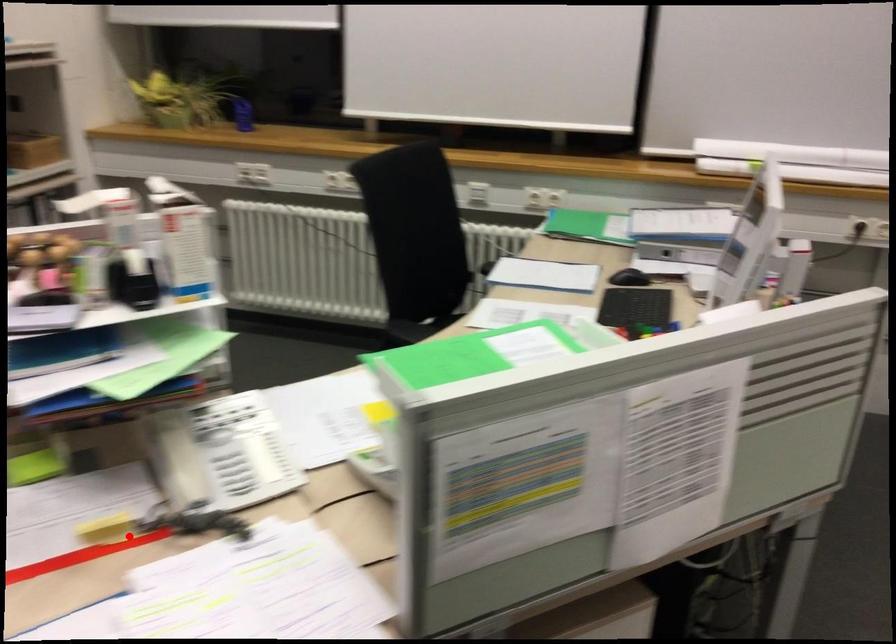
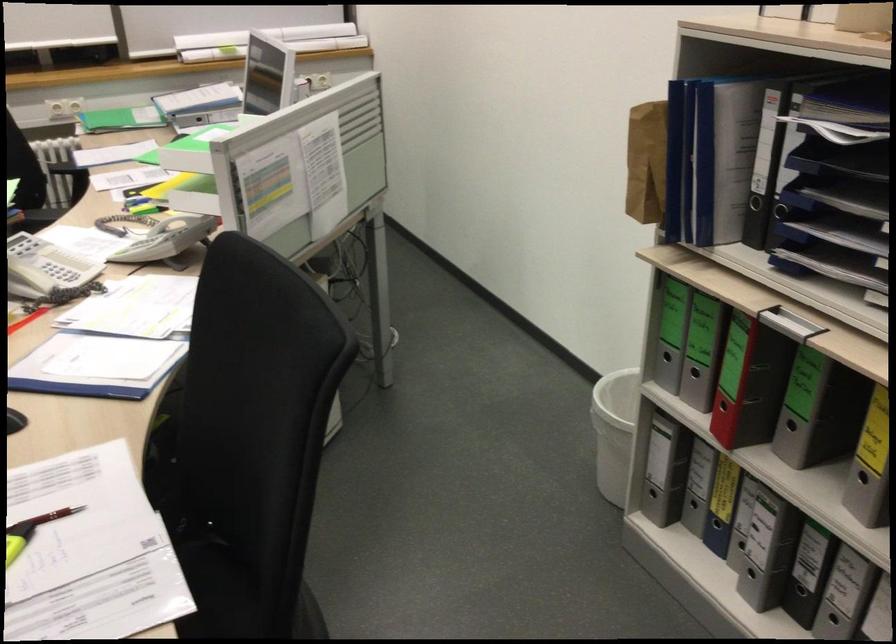
Question: A red point is marked in image1. In image2, is the corresponding 3D point closer to the camera or farther? Reply with the corresponding letter.

Choices:
 (A) The corresponding 3D point is closer.
 (B) The corresponding 3D point is farther.

Answer: (B)